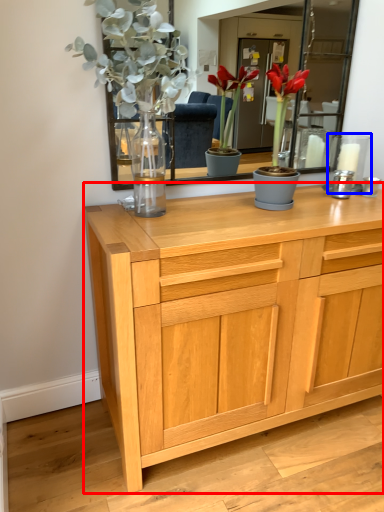
Question: Among these objects, which one is nearest to the camera, chest of drawers (highlighted by a red box) or candle holder (highlighted by a blue box)?

Choices:
 (A) chest of drawers
 (B) candle holder

Answer: (A)